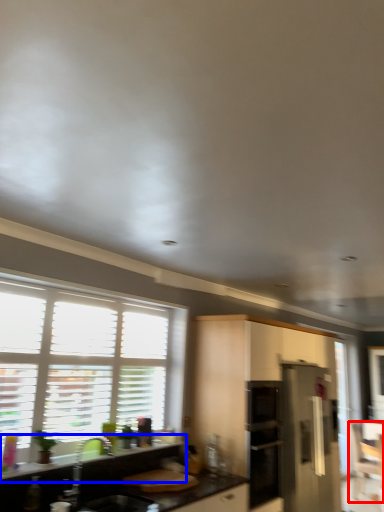
Question: Which object appears farthest to the camera in this image, armchair (highlighted by a red box) or countertop (highlighted by a blue box)?

Choices:
 (A) armchair
 (B) countertop

Answer: (A)